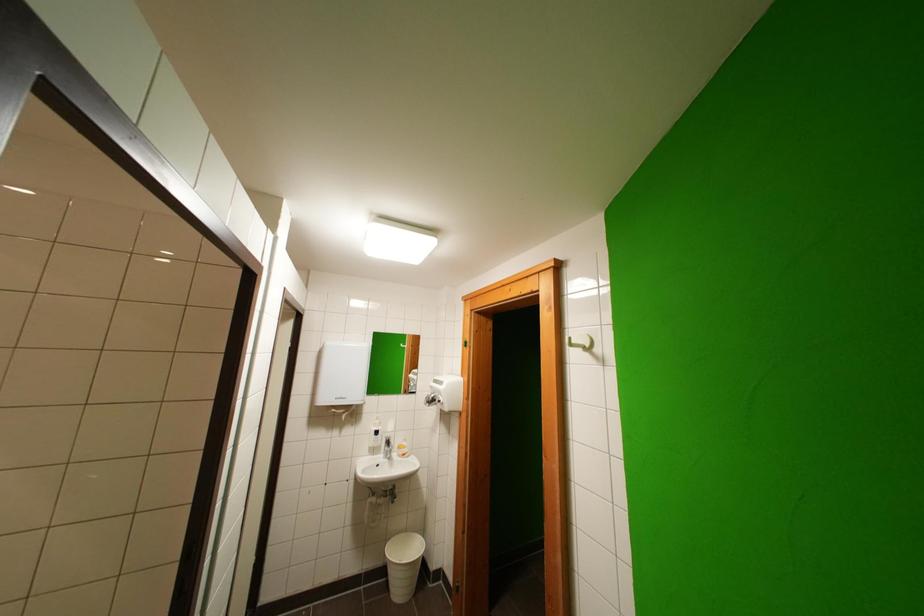
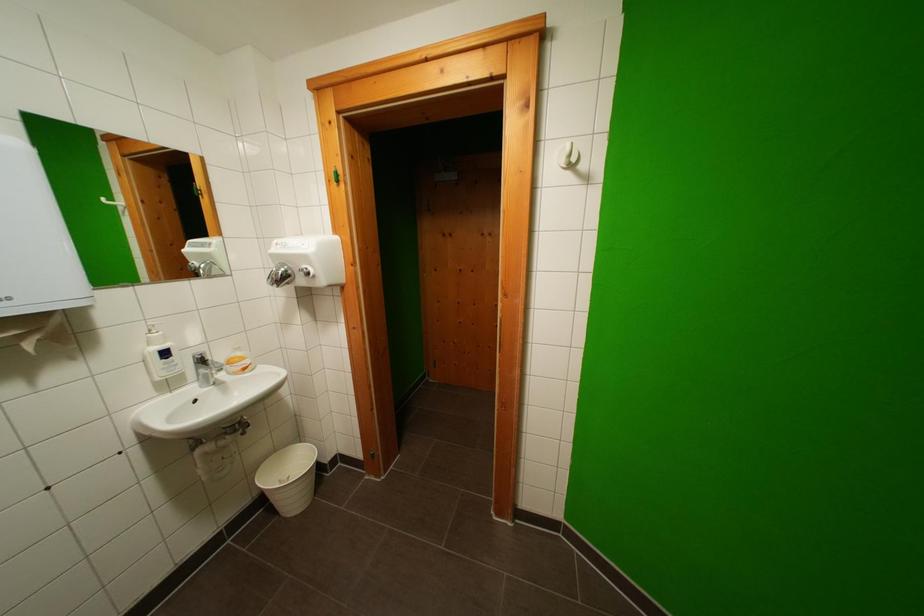
The point at (410,447) is marked in the first image. Where is the corresponding point in the second image?

(246, 357)